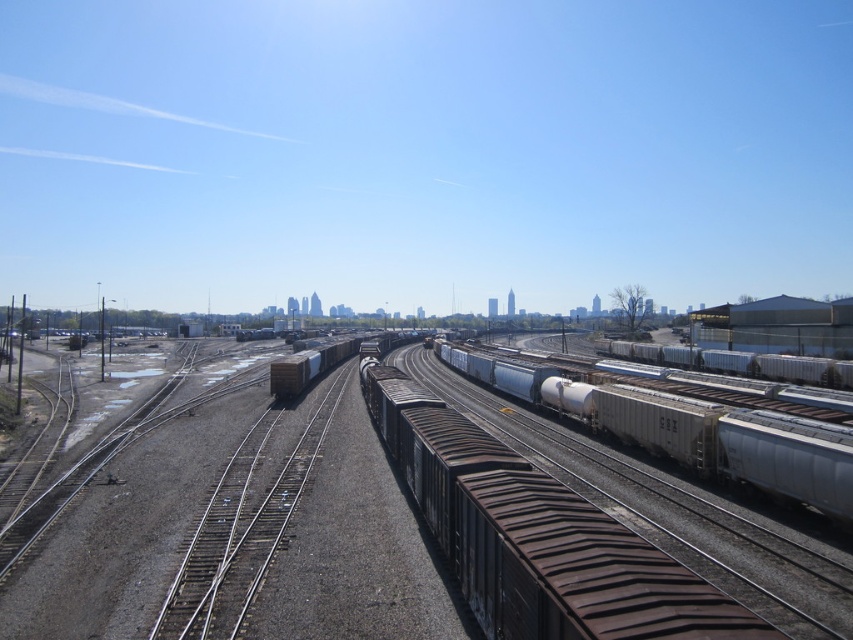
You are a train conductor planning to move a new freight car that is 15 feet long into the railway yard. You need to place it between the metallic silver tank car at center and the brown matte container at center. Is there enough space between them to fit the new freight car?

The metallic silver tank car at center and brown matte container at center are 76.25 feet apart from each other. Since the new freight car is only 15 feet long, there is more than enough space between them to accommodate it.

You are a drone operator trying to navigate between two points in the railway yard. The first point is at coordinate point(723, 436) and the second point is at coordinate point(335, 364). Given that you want to capture the first point in detail, which point should you prioritize focusing on?

Point(723, 436) is closer to the camera than point(335, 364), so you should prioritize focusing on point(723, 436) to capture it in detail.

You are a train conductor who needs to inspect the rusty metal track at center and the metallic silver tank car at center. Which one is positioned lower from the ground?

The rusty metal track at center is located below the metallic silver tank car at center, so the rusty metal track at center is positioned lower from the ground.